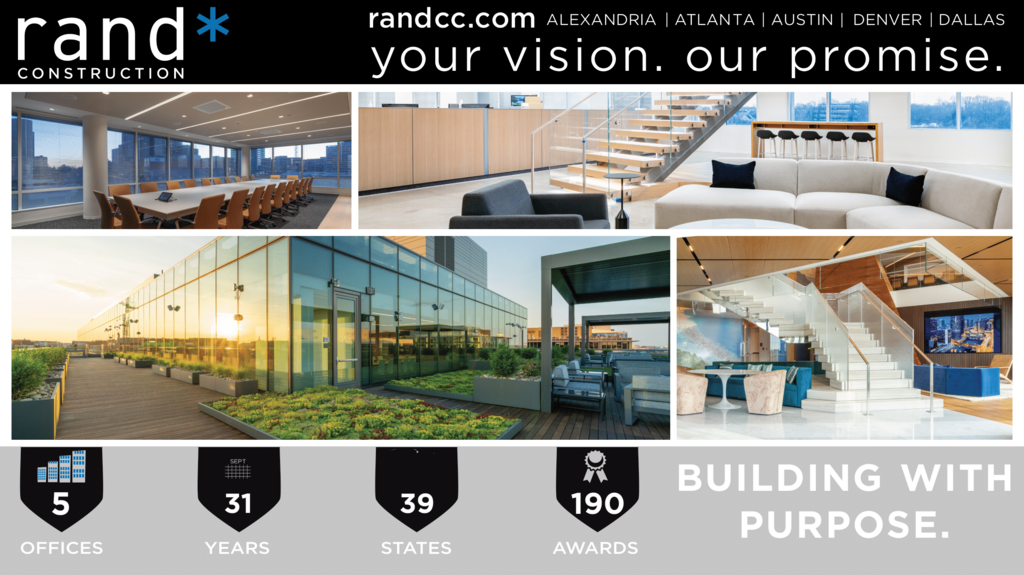
Locate an element on the screen. pillows on the couch is located at coordinates (725, 174), (909, 179).